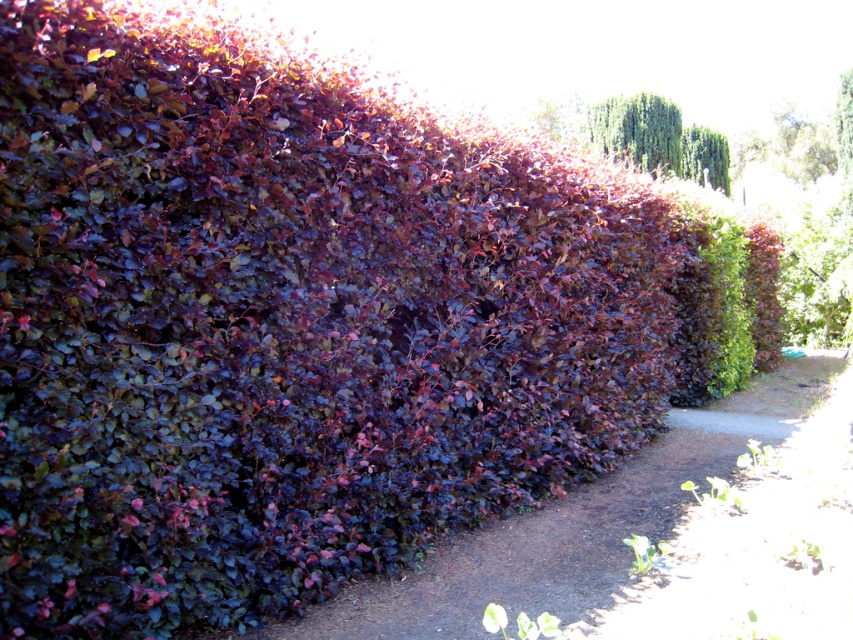
Between purple leafy hedge at center and green textured tree at upper center, which one has less height?

Standing shorter between the two is purple leafy hedge at center.

Does purple leafy hedge at center have a lesser height compared to green textured tree at upper center?

Correct, purple leafy hedge at center is not as tall as green textured tree at upper center.

Where is `purple leafy hedge at center`? purple leafy hedge at center is located at coordinates (654, 536).

This screenshot has width=853, height=640. In order to click on green textured tree at upper center in this screenshot , I will do `click(659, 138)`.

Which of these two, green textured tree at upper center or green leafy plant at lower right, stands shorter?

green leafy plant at lower right

Who is more forward, (664, 152) or (625, 538)?

Positioned in front is point (625, 538).

I want to click on green textured tree at upper center, so click(659, 138).

Is purple leafy hedge at center to the right of green leafy plant at lower right from the viewer's perspective?

In fact, purple leafy hedge at center is to the left of green leafy plant at lower right.

Consider the image. Does purple leafy hedge at center appear on the left side of green leafy plant at lower right?

Indeed, purple leafy hedge at center is positioned on the left side of green leafy plant at lower right.

This screenshot has width=853, height=640. What do you see at coordinates (654, 536) in the screenshot? I see `purple leafy hedge at center` at bounding box center [654, 536].

I want to click on purple leafy hedge at center, so click(x=654, y=536).